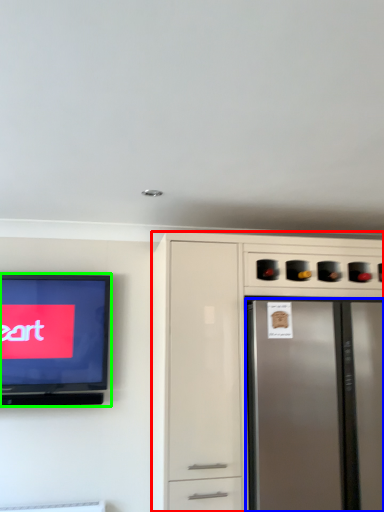
Question: Considering the real-world distances, which object is farthest from cabinetry (highlighted by a red box)? refrigerator (highlighted by a blue box) or television (highlighted by a green box)?

Choices:
 (A) refrigerator
 (B) television

Answer: (B)